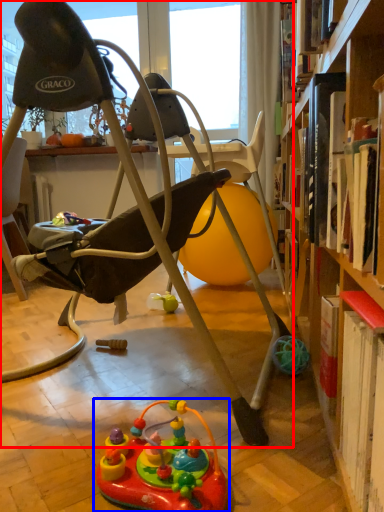
Question: Which object is further to the camera taking this photo, chair (highlighted by a red box) or toy (highlighted by a blue box)?

Choices:
 (A) chair
 (B) toy

Answer: (A)